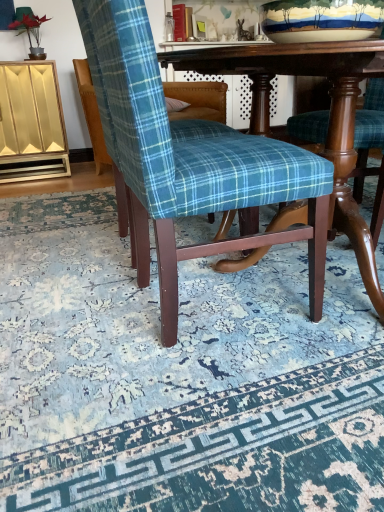
Question: Is blue plaid fabric chair at center located within matte gold cabinet at left?

Choices:
 (A) yes
 (B) no

Answer: (B)

Question: From a real-world perspective, is matte gold cabinet at left over blue plaid fabric chair at center?

Choices:
 (A) no
 (B) yes

Answer: (B)

Question: Does matte gold cabinet at left have a lesser height compared to blue plaid fabric chair at center?

Choices:
 (A) no
 (B) yes

Answer: (A)

Question: Is the depth of matte gold cabinet at left less than that of blue plaid fabric chair at center?

Choices:
 (A) no
 (B) yes

Answer: (A)

Question: Can you confirm if matte gold cabinet at left is bigger than blue plaid fabric chair at center?

Choices:
 (A) no
 (B) yes

Answer: (A)

Question: From the image's perspective, is matte gold cabinet at left on top of blue plaid fabric chair at center?

Choices:
 (A) no
 (B) yes

Answer: (B)

Question: Is blue plaid fabric chair at center touching wooden table at center?

Choices:
 (A) no
 (B) yes

Answer: (A)

Question: From the image's perspective, is blue plaid fabric chair at center on wooden table at center?

Choices:
 (A) no
 (B) yes

Answer: (A)

Question: From a real-world perspective, is blue plaid fabric chair at center over wooden table at center?

Choices:
 (A) yes
 (B) no

Answer: (B)

Question: Considering the relative positions of blue plaid fabric chair at center and wooden table at center in the image provided, is blue plaid fabric chair at center to the right of wooden table at center from the viewer's perspective?

Choices:
 (A) yes
 (B) no

Answer: (B)

Question: Is wooden table at center surrounded by blue plaid fabric chair at center?

Choices:
 (A) no
 (B) yes

Answer: (A)

Question: Is blue plaid fabric chair at center positioned far away from wooden table at center?

Choices:
 (A) yes
 (B) no

Answer: (B)

Question: From the image's perspective, is blue plaid fabric chair at center, the first chair positioned from the front, on top of matte gold cabinet at left?

Choices:
 (A) no
 (B) yes

Answer: (A)